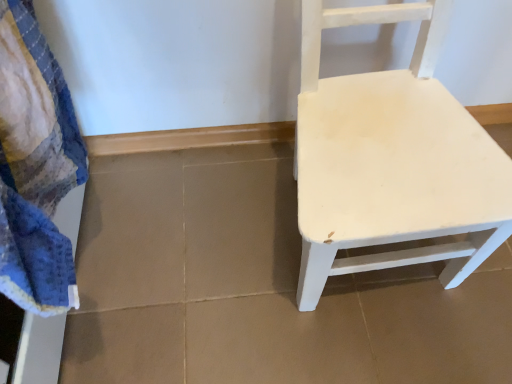
Question: Looking at the image, does blue textured bath towel at left seem bigger or smaller compared to white matte chair at right?

Choices:
 (A) small
 (B) big

Answer: (A)

Question: From a real-world perspective, is blue textured bath towel at left positioned above or below white matte chair at right?

Choices:
 (A) below
 (B) above

Answer: (B)

Question: Is blue textured bath towel at left inside the boundaries of white matte chair at right, or outside?

Choices:
 (A) inside
 (B) outside

Answer: (B)

Question: Is white matte chair at right situated inside blue textured bath towel at left or outside?

Choices:
 (A) inside
 (B) outside

Answer: (B)

Question: Looking at their shapes, would you say white matte chair at right is wider or thinner than blue textured bath towel at left?

Choices:
 (A) wide
 (B) thin

Answer: (A)

Question: Is point (404, 6) positioned closer to the camera than point (4, 49)?

Choices:
 (A) closer
 (B) farther

Answer: (B)

Question: Would you say white matte chair at right is to the left or to the right of blue textured bath towel at left in the picture?

Choices:
 (A) left
 (B) right

Answer: (B)